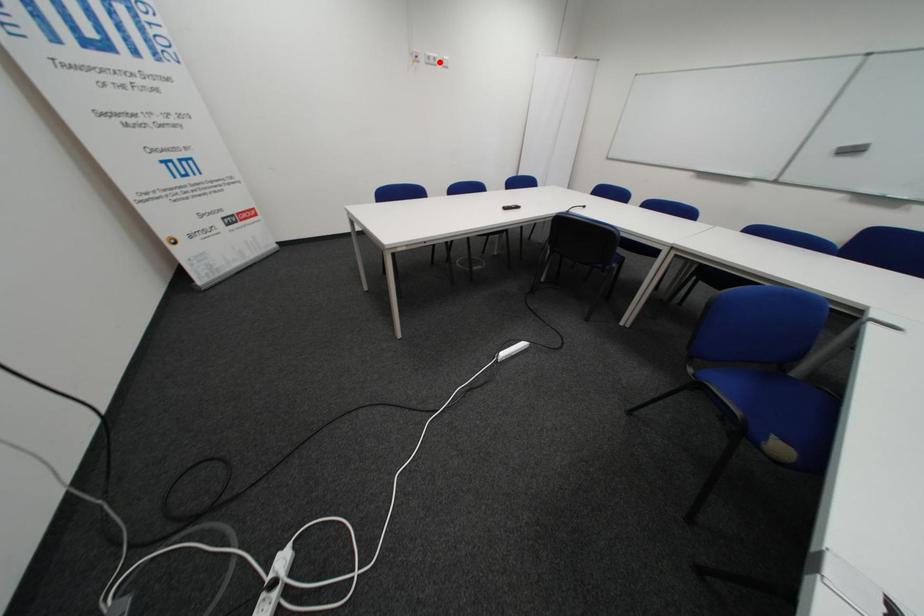
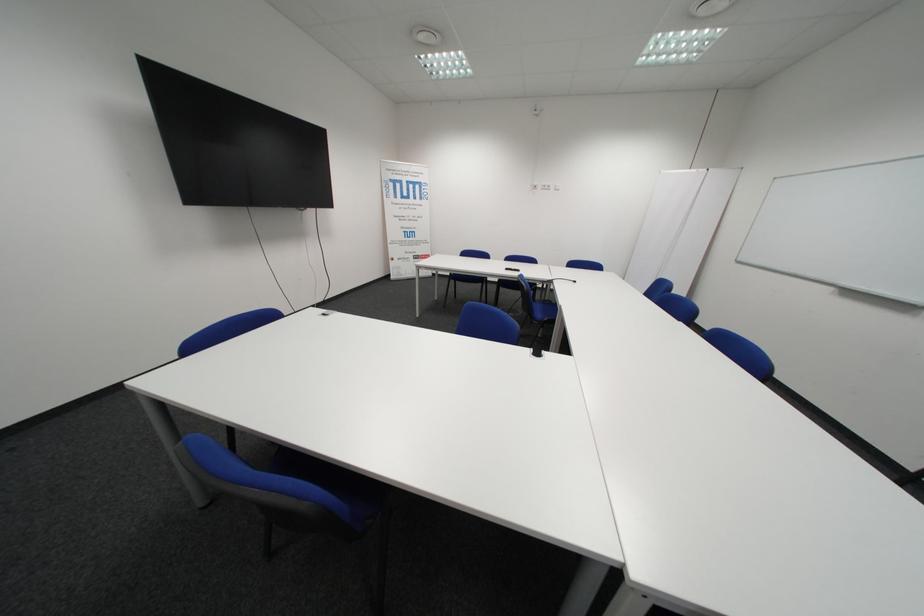
In the second image, find the point that corresponds to the highlighted location in the first image.

(554, 188)